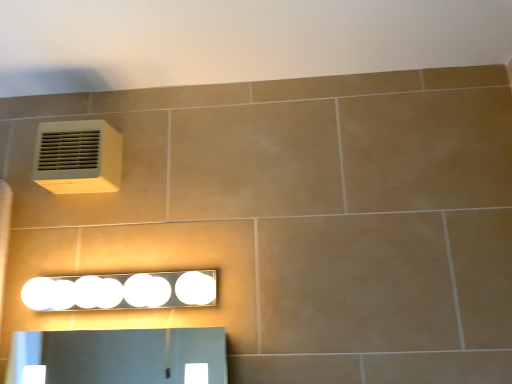
Question: Is point (90, 152) positioned closer to the camera than point (357, 9)?

Choices:
 (A) farther
 (B) closer

Answer: (A)

Question: In the image, is white plastic air conditioning unit at upper left positioned in front of or behind beige tile at upper center?

Choices:
 (A) front
 (B) behind

Answer: (B)

Question: Which object is positioned farthest from the white glossy light fixture at lower center?

Choices:
 (A) beige tile at upper center
 (B) white plastic air conditioning unit at upper left

Answer: (A)

Question: Considering the real-world distances, which object is closest to the white glossy light fixture at lower center?

Choices:
 (A) beige tile at upper center
 (B) white plastic air conditioning unit at upper left

Answer: (B)